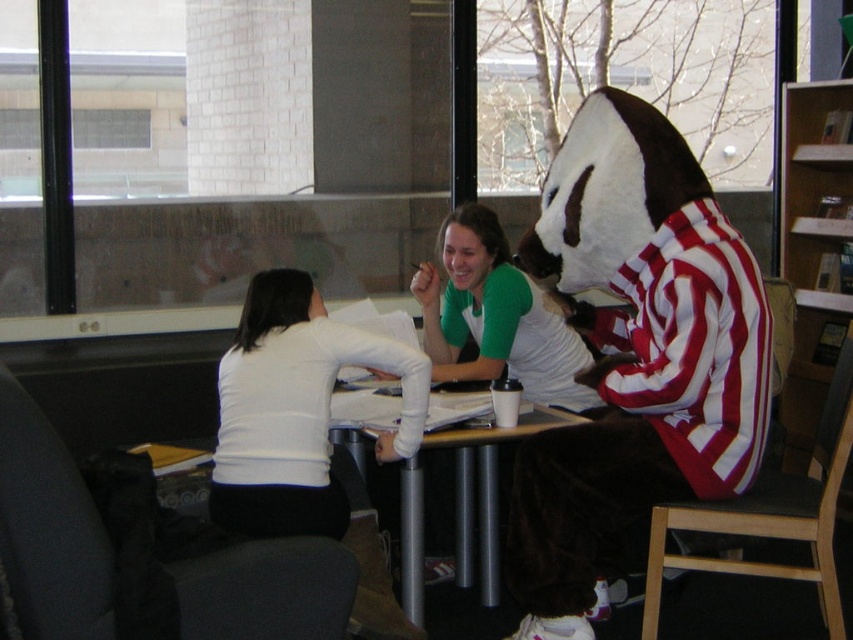
Does black fabric chair at left have a lesser height compared to black fabric chair at lower right?

Indeed, black fabric chair at left has a lesser height compared to black fabric chair at lower right.

Measure the distance between point (38, 588) and camera.

Point (38, 588) is 1.87 meters away from camera.

What are the coordinates of `black fabric chair at left` in the screenshot? It's located at (48, 528).

Between point (223, 506) and point (492, 560), which one is positioned behind?

Point (492, 560)

The image size is (853, 640). Describe the element at coordinates (305, 429) in the screenshot. I see `white matte shirt at center` at that location.

Locate an element on the screen. The image size is (853, 640). white matte shirt at center is located at coordinates (305, 429).

This screenshot has width=853, height=640. Identify the location of white matte shirt at center. (305, 429).

Between white matte shirt at center and black fabric chair at lower right, which one has less height?

white matte shirt at center is shorter.

Who is positioned more to the left, white matte shirt at center or black fabric chair at lower right?

From the viewer's perspective, white matte shirt at center appears more on the left side.

Who is more forward, (x=248, y=296) or (x=787, y=531)?

Point (x=787, y=531) is more forward.

Locate an element on the screen. This screenshot has width=853, height=640. white matte shirt at center is located at coordinates (305, 429).